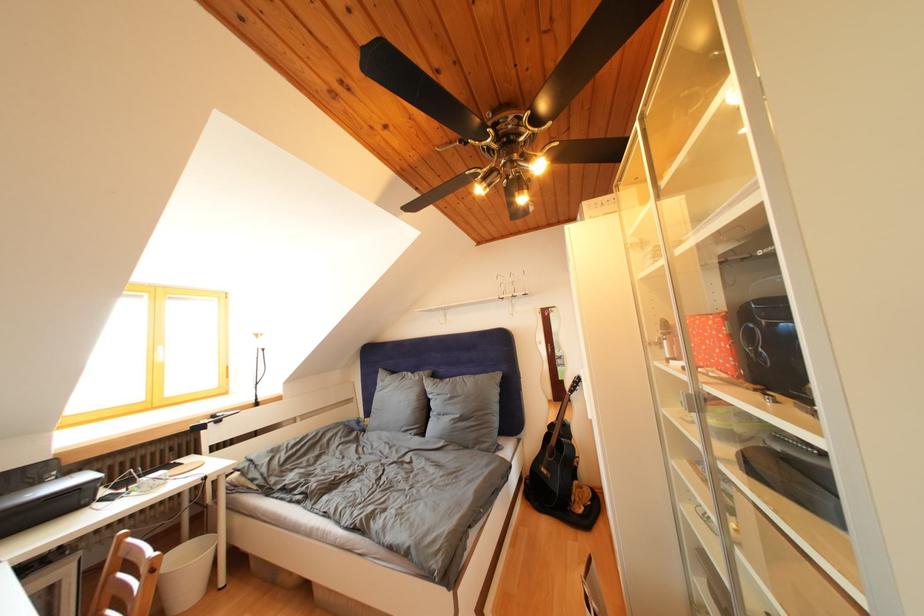
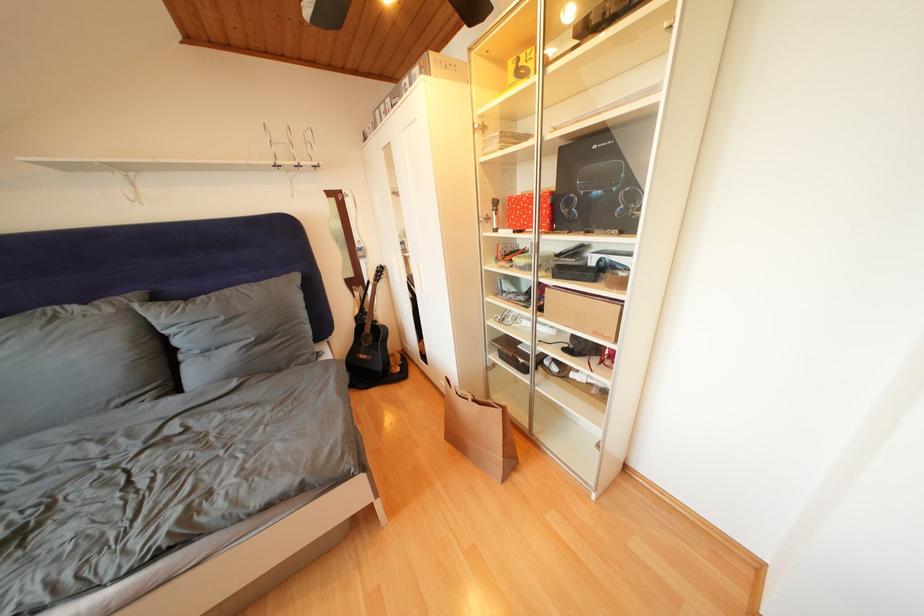
First-person continuous shooting, in which direction is the camera rotating?

The camera rotated toward right-down.